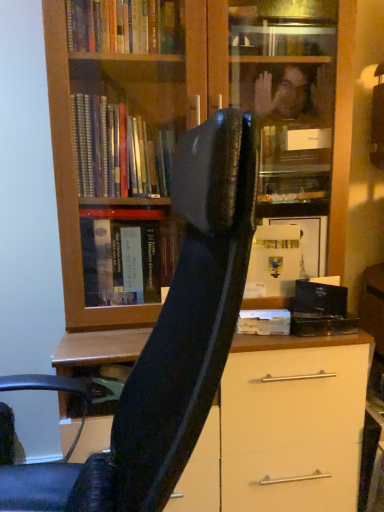
Where is `white matte paper at center`? white matte paper at center is located at coordinates (264, 322).

The image size is (384, 512). What do you see at coordinates (170, 339) in the screenshot?
I see `black leather chair at center` at bounding box center [170, 339].

Where is `wooden bookcase at center`? wooden bookcase at center is located at coordinates (190, 125).

From a real-world perspective, who is located higher, black leather chair at center or white matte paper at center?

black leather chair at center is physically above.

Measure the distance between black leather chair at center and white matte paper at center.

black leather chair at center and white matte paper at center are 21.00 inches apart.

Between black leather chair at center and white matte paper at center, which one has smaller width?

With smaller width is white matte paper at center.

Which is closer to the camera, (237, 197) or (247, 331)?

Clearly, point (237, 197) is closer to the camera than point (247, 331).

In the scene shown: Is wooden bookcase at center directly adjacent to white matte paper at center?

They are not placed beside each other.

Considering the sizes of wooden bookcase at center and white matte paper at center in the image, is wooden bookcase at center taller or shorter than white matte paper at center?

wooden bookcase at center is taller than white matte paper at center.

From a real-world perspective, relative to white matte paper at center, is wooden bookcase at center vertically above or below?

Clearly, from a real-world perspective, wooden bookcase at center is above white matte paper at center.

From the image's perspective, is white matte paper at center located above or below wooden bookcase at center?

From the image's perspective, white matte paper at center appears below wooden bookcase at center.

Can wooden bookcase at center be found inside white matte paper at center?

No, wooden bookcase at center is not a part of white matte paper at center.

Based on the photo, from a real-world perspective, is white matte paper at center over wooden bookcase at center?

No, from a real-world perspective, white matte paper at center is not above wooden bookcase at center.

Which of these two, white matte paper at center or black leather chair at center, is wider?

black leather chair at center is wider.

Image resolution: width=384 pixels, height=512 pixels. What are the coordinates of `paperback book that is on the right side of black leather chair at center` in the screenshot? It's located at (264, 322).

Can you confirm if white matte paper at center is taller than black leather chair at center?

No, white matte paper at center is not taller than black leather chair at center.

Which is behind, white matte paper at center or black leather chair at center?

white matte paper at center.

Is black leather chair at center in front of wooden bookcase at center?

Yes.

Where is `bookcase above the black leather chair at center (from the image's perspective)`? The width and height of the screenshot is (384, 512). bookcase above the black leather chair at center (from the image's perspective) is located at coordinates (190, 125).

From a real-world perspective, who is located higher, black leather chair at center or wooden bookcase at center?

wooden bookcase at center, from a real-world perspective.

Can you tell me how much black leather chair at center and wooden bookcase at center differ in facing direction?

They differ by 89.3 degrees in their facing directions.

Considering the relative sizes of wooden bookcase at center and black leather chair at center in the image provided, is wooden bookcase at center bigger than black leather chair at center?

Correct, wooden bookcase at center is larger in size than black leather chair at center.

Considering the points (263, 35) and (183, 446), which point is in front, point (263, 35) or point (183, 446)?

Point (183, 446)

Considering the sizes of wooden bookcase at center and black leather chair at center in the image, is wooden bookcase at center wider or thinner than black leather chair at center?

Considering their sizes, wooden bookcase at center looks slimmer than black leather chair at center.

Considering the relative sizes of wooden bookcase at center and black leather chair at center in the image provided, is wooden bookcase at center taller than black leather chair at center?

Yes, wooden bookcase at center is taller than black leather chair at center.

Identify the location of chair above the white matte paper at center (from a real-world perspective). The width and height of the screenshot is (384, 512). (170, 339).

Where is `paperback book that is below the wooden bookcase at center (from the image's perspective)`? The height and width of the screenshot is (512, 384). paperback book that is below the wooden bookcase at center (from the image's perspective) is located at coordinates (264, 322).

Looking at the image, which one is located closer to white matte paper at center, black leather chair at center or wooden bookcase at center?

Among the two, black leather chair at center is located nearer to white matte paper at center.

Looking at the image, which one is located further to wooden bookcase at center, black leather chair at center or white matte paper at center?

Based on the image, white matte paper at center appears to be further to wooden bookcase at center.

From the image, which object appears to be farther from wooden bookcase at center, white matte paper at center or black leather chair at center?

white matte paper at center lies further to wooden bookcase at center than the other object.

Based on their spatial positions, is white matte paper at center or wooden bookcase at center closer to black leather chair at center?

The object closer to black leather chair at center is white matte paper at center.

Which object lies nearer to the anchor point white matte paper at center, wooden bookcase at center or black leather chair at center?

black leather chair at center is closer to white matte paper at center.

From the image, which object appears to be nearer to black leather chair at center, wooden bookcase at center or white matte paper at center?

Among the two, white matte paper at center is located nearer to black leather chair at center.

Find the location of a particular element. The height and width of the screenshot is (512, 384). bookcase located between black leather chair at center and white matte paper at center in the depth direction is located at coordinates (190, 125).